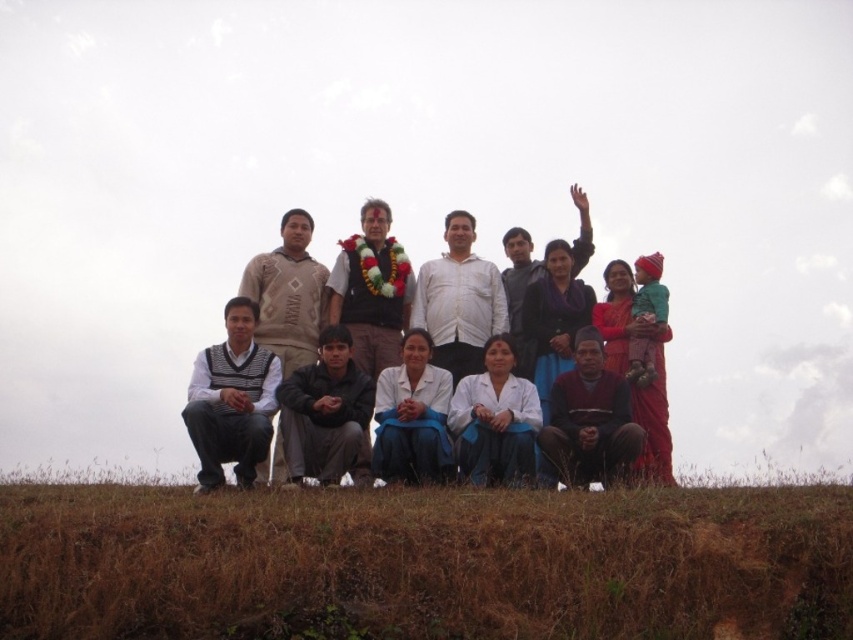
Question: Does white cotton shirt at center have a larger size compared to white matte shirt at center?

Choices:
 (A) yes
 (B) no

Answer: (A)

Question: Can you confirm if striped sweater at lower left is thinner than black cotton sweater at lower center?

Choices:
 (A) no
 (B) yes

Answer: (B)

Question: Which object is farther from the camera taking this photo?

Choices:
 (A) white cotton shirt at center
 (B) brown cotton sweater at lower center
 (C) white matte shirt at center
 (D) black cotton sweater at lower center

Answer: (C)

Question: Among these objects, which one is nearest to the camera?

Choices:
 (A) white cotton shirt at center
 (B) brown grass at lower center

Answer: (B)

Question: Does white cotton shirt at center have a lesser width compared to white matte shirt at center?

Choices:
 (A) no
 (B) yes

Answer: (A)

Question: Which of the following is the farthest from the observer?

Choices:
 (A) (45, 620)
 (B) (444, 284)
 (C) (207, 442)
 (D) (335, 397)

Answer: (B)